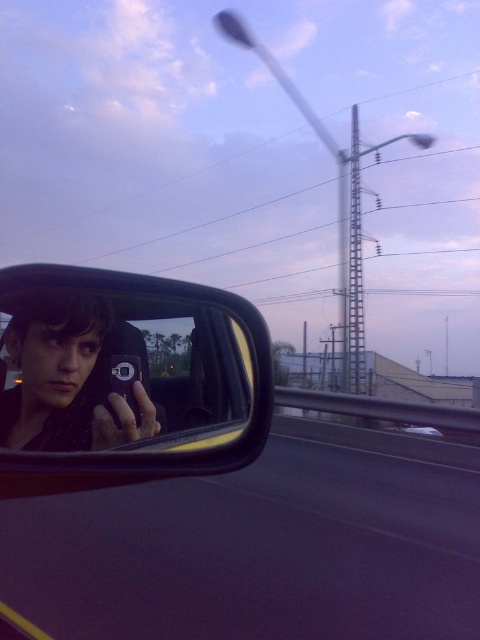
Question: Observing the image, what is the correct spatial positioning of shiny black phone at center in reference to metallic silver car at center?

Choices:
 (A) right
 (B) left

Answer: (B)

Question: From the image, what is the correct spatial relationship of shiny black phone at center in relation to metallic silver car at center?

Choices:
 (A) below
 (B) above

Answer: (B)

Question: Is shiny black phone at center below metallic silver car at center?

Choices:
 (A) yes
 (B) no

Answer: (B)

Question: Which of the following is the farthest from the observer?

Choices:
 (A) (9, 426)
 (B) (428, 433)

Answer: (B)

Question: Which point is farther to the camera?

Choices:
 (A) metallic silver car at center
 (B) shiny black phone at center

Answer: (A)